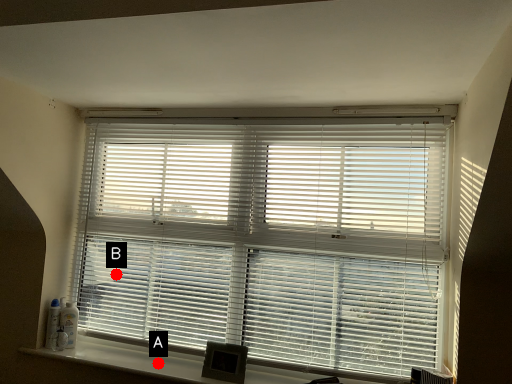
Question: Two points are circled on the image, labeled by A and B beside each circle. Which point appears closest to the camera in this image?

Choices:
 (A) A is closer
 (B) B is closer

Answer: (A)